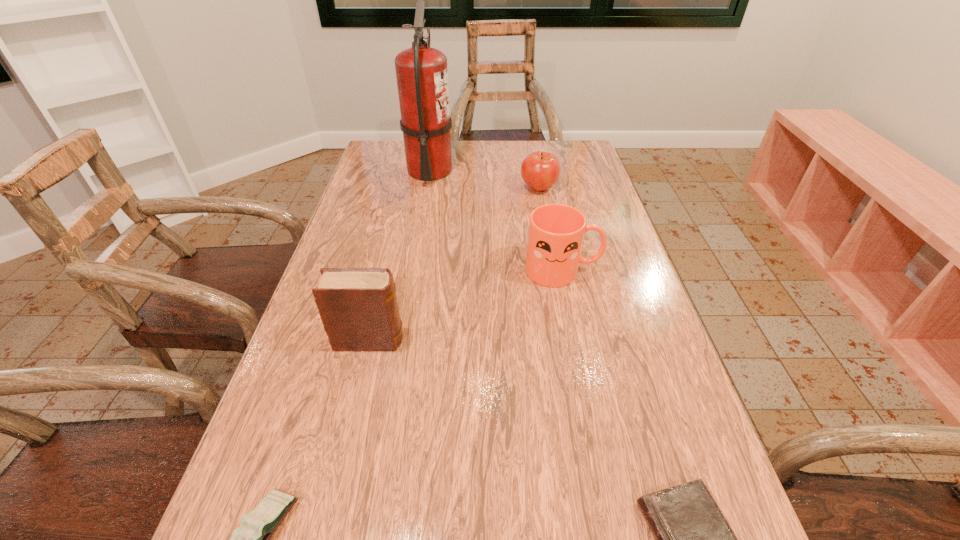
Where is `the tallest object`? the tallest object is located at coordinates (421, 71).

I want to click on the fourth farthest object, so click(358, 307).

The width and height of the screenshot is (960, 540). I want to click on the tallest diary, so click(358, 307).

Identify the location of mug. The height and width of the screenshot is (540, 960). (556, 231).

Identify the location of apple. The height and width of the screenshot is (540, 960). (540, 170).

Locate an element on the screen. The image size is (960, 540). vacant point located toward the nozzle of the fire extinguisher is located at coordinates (518, 171).

Find the location of a particular element. free region located 0.370m on the spine side of the tallest diary is located at coordinates (585, 340).

This screenshot has width=960, height=540. I want to click on free region located on the handle side of the third farthest object, so click(620, 271).

What are the coordinates of `vacant space located 0.120m on the right of the apple` in the screenshot? It's located at (597, 188).

The width and height of the screenshot is (960, 540). What are the coordinates of `object that is at the far edge` in the screenshot? It's located at (421, 71).